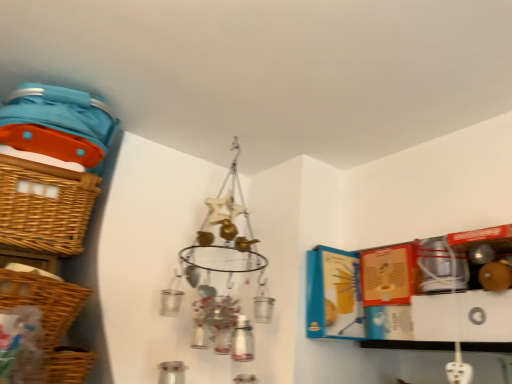
Question: From a real-world perspective, is woven brown basket at left, placed as the second basket when sorted from top to bottom, positioned above or below woven brown basket at left, which is the third basket from bottom to top?

Choices:
 (A) above
 (B) below

Answer: (B)

Question: From the image's perspective, is woven brown basket at left, placed as the second basket when sorted from top to bottom, located above or below woven brown basket at left, which is the third basket from bottom to top?

Choices:
 (A) below
 (B) above

Answer: (A)

Question: Which is farther from the woven brown basket at left, the second basket when ordered from bottom to top?

Choices:
 (A) woven brown basket at left, which is the third basket from bottom to top
 (B) woven brown basket at lower left, the first basket in the bottom-to-top sequence

Answer: (A)

Question: Which object is positioned closest to the woven brown basket at left, which is the third basket from bottom to top?

Choices:
 (A) woven brown basket at lower left, which is the 3th basket from top to bottom
 (B) woven brown basket at left, the second basket when ordered from bottom to top

Answer: (B)